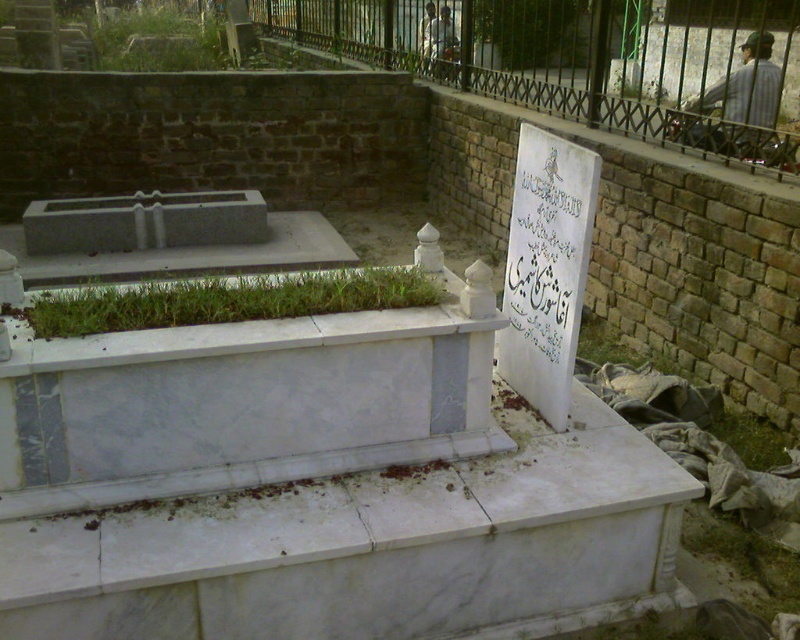
Question: Which object is farther from the camera taking this photo?

Choices:
 (A) black wrought iron fence at upper right
 (B) green grass at center
 (C) white paper at right

Answer: (A)

Question: Is black wrought iron fence at upper right wider than striped shirt at upper right?

Choices:
 (A) yes
 (B) no

Answer: (A)

Question: Which object appears farthest from the camera in this image?

Choices:
 (A) green grass at center
 (B) white paper at right
 (C) black wrought iron fence at upper right

Answer: (C)

Question: In this image, where is green grass at center located relative to striped shirt at upper right?

Choices:
 (A) above
 (B) below

Answer: (B)

Question: Which point is farther from the camera taking this photo?

Choices:
 (A) (225, 323)
 (B) (532, 355)

Answer: (B)

Question: Can you confirm if green grass at center is positioned above striped shirt at upper right?

Choices:
 (A) no
 (B) yes

Answer: (A)